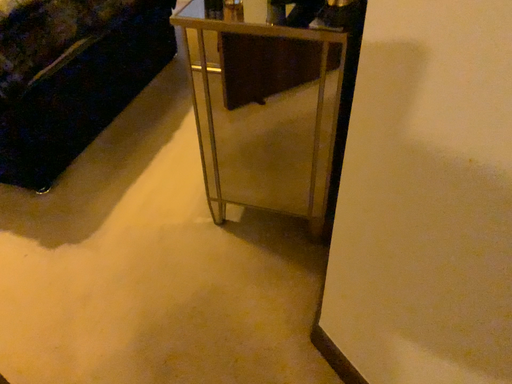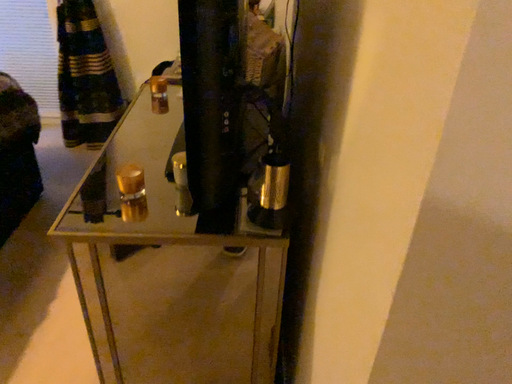
Question: How did the camera likely rotate when shooting the video?

Choices:
 (A) rotated downward
 (B) rotated upward

Answer: (B)